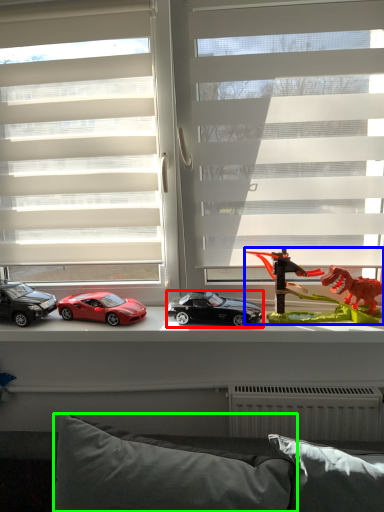
Question: Which object is positioned closest to car (highlighted by a red box)? Select from toy (highlighted by a blue box) and pillow (highlighted by a green box).

Choices:
 (A) toy
 (B) pillow

Answer: (A)